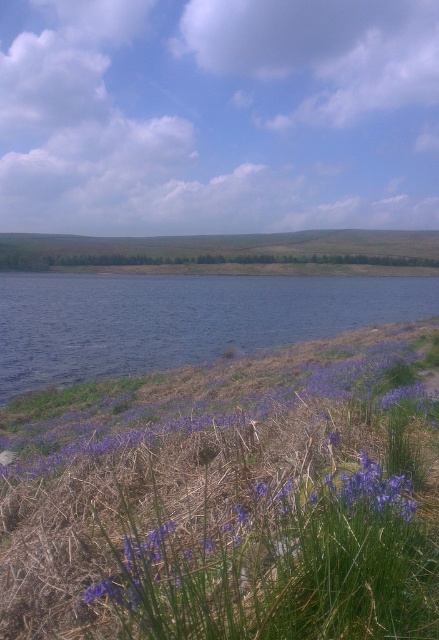
Which is behind, point (97, 468) or point (58, 451)?

Positioned behind is point (58, 451).

Locate an element on the screen. The height and width of the screenshot is (640, 439). purple grass at lower center is located at coordinates point(231,500).

From the picture: Can you confirm if purple grass at lower center is thinner than blue liquid water at lower left?

Yes.

This screenshot has height=640, width=439. What do you see at coordinates (231, 500) in the screenshot?
I see `purple grass at lower center` at bounding box center [231, 500].

Which is behind, point (335, 608) or point (7, 369)?

The point (7, 369) is more distant.

The image size is (439, 640). In order to click on purple grass at lower center in this screenshot , I will do `click(231, 500)`.

Is the position of blue liquid water at lower left less distant than that of purple matte flower at lower left?

No, blue liquid water at lower left is further to the viewer.

Is blue liquid water at lower left bigger than purple matte flower at lower left?

Yes.

Does point (298, 298) come behind point (104, 384)?

That is True.

Locate an element on the screen. The height and width of the screenshot is (640, 439). blue liquid water at lower left is located at coordinates coord(179,320).